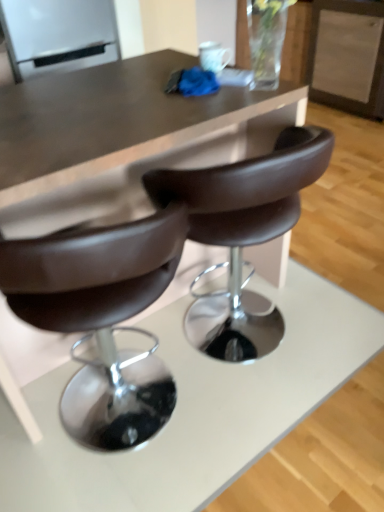
In order to face matte brown table at center, should I rotate leftwards or rightwards?

It's best to rotate left around 10.651 degrees.

Find the location of a particular element. matte brown table at center is located at coordinates (118, 121).

Which of these two, brown leather chair at center or white glossy refrigerator at upper left, stands shorter?

Standing shorter between the two is white glossy refrigerator at upper left.

Is brown leather chair at center thinner than white glossy refrigerator at upper left?

A: Indeed, brown leather chair at center has a lesser width compared to white glossy refrigerator at upper left.

Is there a large distance between brown leather chair at center and white glossy refrigerator at upper left?

brown leather chair at center is far away from white glossy refrigerator at upper left.

Would you say matte brown table at center is inside or outside brown leather chair at center?

The correct answer is: outside.

From the image's perspective, between matte brown table at center and brown leather chair at center, who is located below?

brown leather chair at center, from the image's perspective.

Between point (271, 279) and point (309, 139), which one is positioned behind?

The point (271, 279) is farther from the camera.

Which of these two, matte brown table at center or brown leather chair at center, is wider?

matte brown table at center is wider.

Identify the location of table on the right of white glossy refrigerator at upper left. Image resolution: width=384 pixels, height=512 pixels. (118, 121).

Is matte brown table at center not inside white glossy refrigerator at upper left?

Yes, matte brown table at center is outside of white glossy refrigerator at upper left.

Is matte brown table at center bigger than white glossy refrigerator at upper left?

Indeed, matte brown table at center has a larger size compared to white glossy refrigerator at upper left.

From a real-world perspective, between matte brown table at center and white glossy refrigerator at upper left, who is vertically lower?

matte brown table at center.

Consider the image. Based on their positions, is white glossy refrigerator at upper left located to the left or right of matte brown table at center?

white glossy refrigerator at upper left is positioned on matte brown table at center's left side.

Relative to matte brown table at center, is white glossy refrigerator at upper left in front or behind?

white glossy refrigerator at upper left is positioned farther from the viewer than matte brown table at center.

Is matte brown table at center at the back of white glossy refrigerator at upper left?

white glossy refrigerator at upper left does not have its back to matte brown table at center.

From the image's perspective, which is above, white glossy refrigerator at upper left or matte brown table at center?

From the image's view, white glossy refrigerator at upper left is above.

You are a GUI agent. You are given a task and a screenshot of the screen. Output one action in this format:
    pyautogui.click(x=<x>, y=<y>)
    Task: Click on the chair that is below the matte brown table at center (from the image's perspective)
    Image resolution: width=384 pixels, height=512 pixels.
    Given the screenshot: What is the action you would take?
    pyautogui.click(x=243, y=230)

From the image's perspective, which is above, brown leather chair at center or matte brown table at center?

matte brown table at center appears higher in the image.

Would you say brown leather chair at center is a long distance from matte brown table at center?

brown leather chair at center is actually quite close to matte brown table at center.

Can you confirm if white glossy refrigerator at upper left is positioned to the right of brown leather chair at center?

Incorrect, white glossy refrigerator at upper left is not on the right side of brown leather chair at center.

Who is taller, white glossy refrigerator at upper left or brown leather chair at center?

With more height is brown leather chair at center.

Can you confirm if white glossy refrigerator at upper left is smaller than brown leather chair at center?

Yes, white glossy refrigerator at upper left is smaller than brown leather chair at center.

Which object is thinner, white glossy refrigerator at upper left or brown leather chair at center?

With smaller width is brown leather chair at center.

Image resolution: width=384 pixels, height=512 pixels. Find the location of `chair that appears below the white glossy refrigerator at upper left (from a real-world perspective)`. chair that appears below the white glossy refrigerator at upper left (from a real-world perspective) is located at coordinates (243, 230).

Find the location of a particular element. chair behind the matte brown table at center is located at coordinates (243, 230).

Which object lies nearer to the anchor point brown leather chair at center, white glossy refrigerator at upper left or matte brown table at center?

Among the two, matte brown table at center is located nearer to brown leather chair at center.

Looking at the image, which one is located closer to white glossy refrigerator at upper left, matte brown table at center or brown leather chair at center?

matte brown table at center.

Looking at the image, which one is located closer to white glossy refrigerator at upper left, brown leather chair at center or matte brown table at center?

matte brown table at center is closer to white glossy refrigerator at upper left.

Considering their positions, is brown leather chair at center positioned further to matte brown table at center than white glossy refrigerator at upper left?

Based on the image, white glossy refrigerator at upper left appears to be further to matte brown table at center.

Estimate the real-world distances between objects in this image. Which object is closer to matte brown table at center, white glossy refrigerator at upper left or brown leather chair at center?

brown leather chair at center is positioned closer to the anchor matte brown table at center.

Which object lies nearer to the anchor point brown leather chair at center, matte brown table at center or white glossy refrigerator at upper left?

matte brown table at center is positioned closer to the anchor brown leather chair at center.

You are a GUI agent. You are given a task and a screenshot of the screen. Output one action in this format:
    pyautogui.click(x=<x>, y=<y>)
    Task: Click on the table between white glossy refrigerator at upper left and brown leather chair at center in the vertical direction
    The width and height of the screenshot is (384, 512).
    Given the screenshot: What is the action you would take?
    pyautogui.click(x=118, y=121)